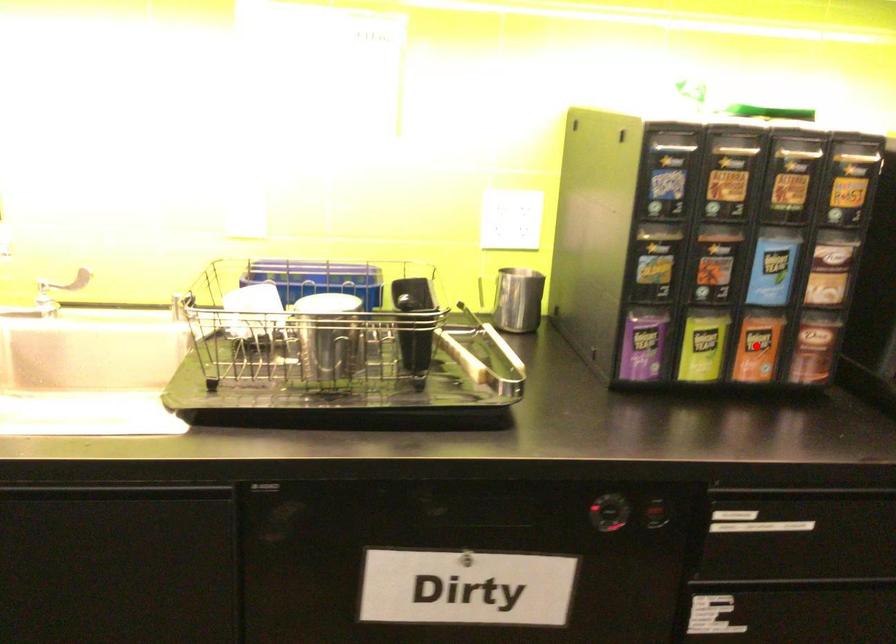
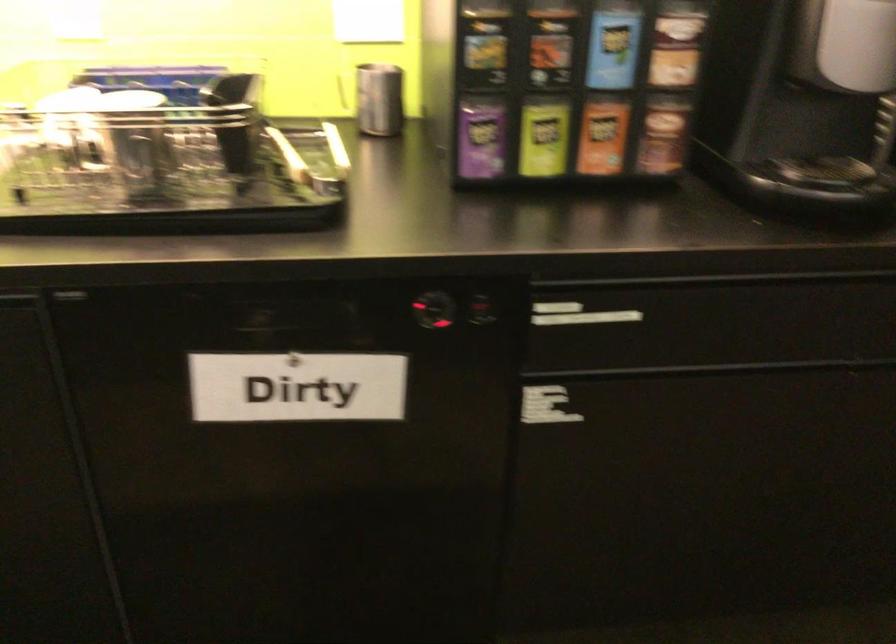
In the second image, find the point that corresponds to the highlighted location in the first image.

(602, 136)